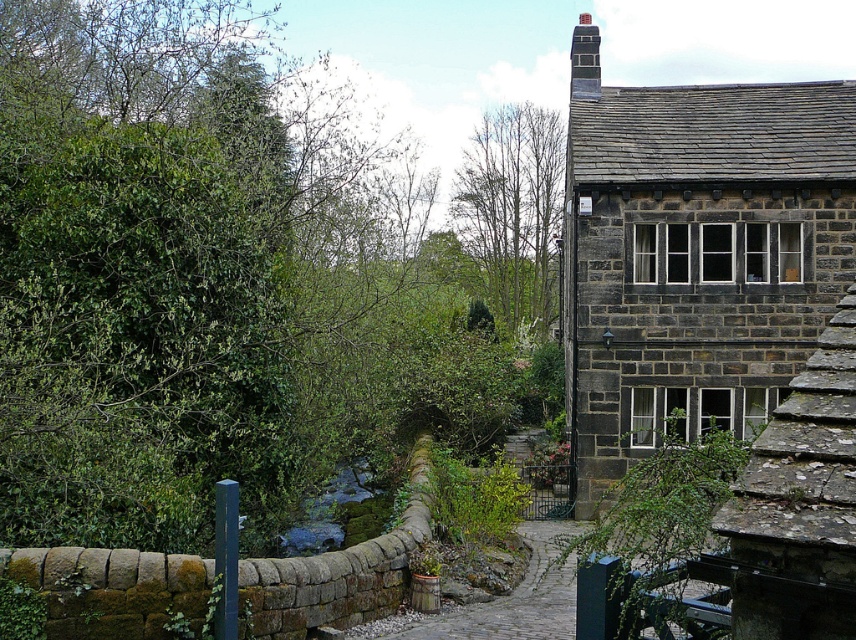
Can you confirm if green leafy tree at upper left is shorter than smooth brick chimney at upper right?

Incorrect, green leafy tree at upper left's height does not fall short of smooth brick chimney at upper right's.

Image resolution: width=856 pixels, height=640 pixels. Describe the element at coordinates (235, 276) in the screenshot. I see `green leafy tree at upper left` at that location.

Locate an element on the screen. This screenshot has height=640, width=856. green leafy tree at upper left is located at coordinates (235, 276).

This screenshot has width=856, height=640. What do you see at coordinates (339, 513) in the screenshot? I see `green mossy stone at center` at bounding box center [339, 513].

Can you confirm if green mossy stone at center is thinner than smooth brick chimney at upper right?

Yes, green mossy stone at center is thinner than smooth brick chimney at upper right.

Which is behind, point (383, 524) or point (574, 84)?

Positioned behind is point (574, 84).

You are a GUI agent. You are given a task and a screenshot of the screen. Output one action in this format:
    pyautogui.click(x=<x>, y=<y>)
    Task: Click on the green mossy stone at center
    
    Given the screenshot: What is the action you would take?
    pyautogui.click(x=339, y=513)

Measure the distance between point (25, 61) and camera.

Point (25, 61) is 61.67 feet from camera.

Which is behind, point (372, 339) or point (508, 150)?

The point (508, 150) is behind.

This screenshot has height=640, width=856. In order to click on green leafy tree at upper left in this screenshot , I will do `click(235, 276)`.